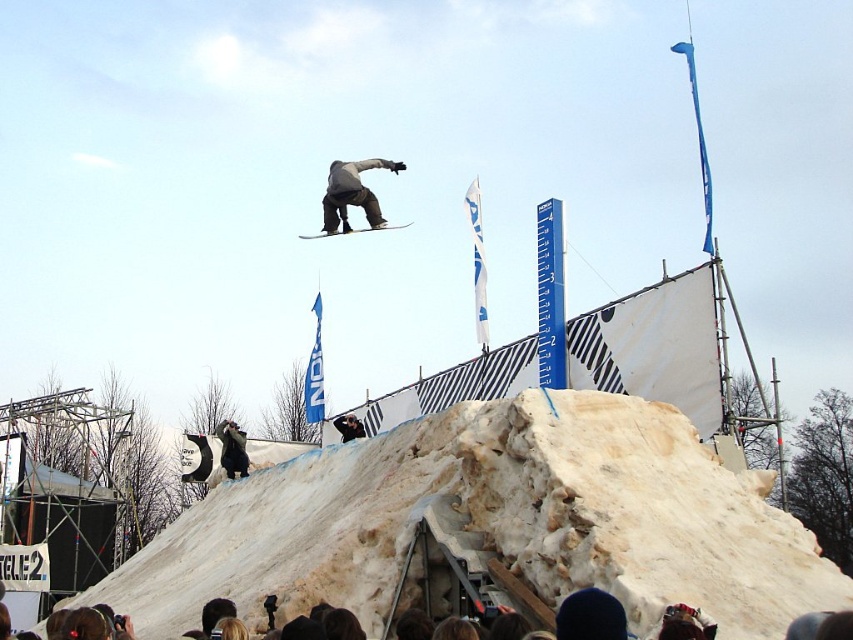
Question: Can you confirm if gray matte snowboarder at center is positioned below matte black snowboard at center?

Choices:
 (A) yes
 (B) no

Answer: (B)

Question: Which point is closer to the camera?

Choices:
 (A) white fluffy mound at lower center
 (B) matte black snowboard at center
 (C) gray matte snowboarder at center

Answer: (A)

Question: Which of these objects is positioned closest to the gray matte snowboarder at center?

Choices:
 (A) matte black snowboard at center
 (B) white fluffy mound at lower center

Answer: (A)

Question: In this image, where is white fluffy mound at lower center located relative to matte black snowboard at center?

Choices:
 (A) above
 (B) below

Answer: (B)

Question: Does white fluffy mound at lower center have a smaller size compared to matte black snowboard at center?

Choices:
 (A) yes
 (B) no

Answer: (B)

Question: Which point is farther to the camera?

Choices:
 (A) gray matte snowboarder at center
 (B) white fluffy mound at lower center

Answer: (A)